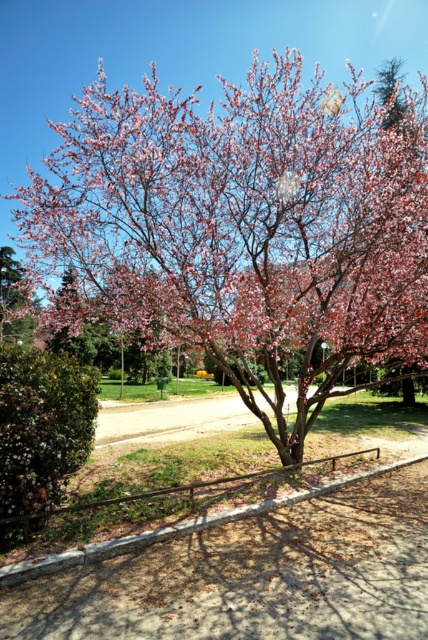
You are a gardener trying to identify the largest pink matte object in the scene. Which one is it between the pink matte flower at center and the pink matte tree at upper left?

The pink matte flower at center has a larger size compared to the pink matte tree at upper left, so the largest pink matte object is the pink matte flower at center.

You are standing in the park and see the pink matte flower at center. If you walk straight ahead, will you reach the flower before the stone wall?

The pink matte flower at center is located at point (243, 212), which is closer to you than the stone wall, so yes, you will reach the flower before the stone wall.

You are standing in the park and want to take a photo of the blossoming tree. You notice two points in the scene labeled as point (x=196, y=241) and point (x=2, y=292). Which point should you focus on to ensure the blossoming tree is in sharp focus?

You should focus on point (x=196, y=241) because it is closer to the camera than point (x=2, y=292), ensuring the blossoming tree will be in sharp focus.